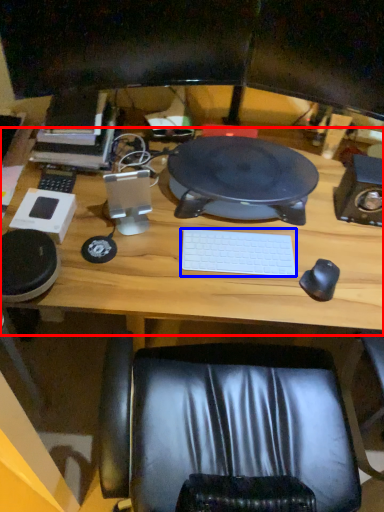
Question: Which object is further to the camera taking this photo, computer desk (highlighted by a red box) or laptop keyboard (highlighted by a blue box)?

Choices:
 (A) computer desk
 (B) laptop keyboard

Answer: (B)